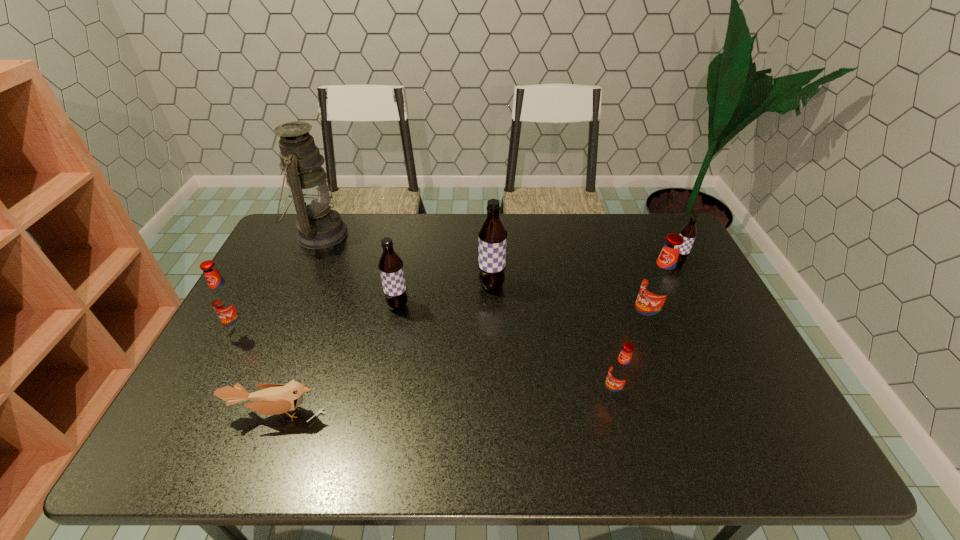
You are a GUI agent. You are given a task and a screenshot of the screen. Output one action in this format:
    pyautogui.click(x=<x>, y=<y>)
    Task: Click on the vacant space positioned on the back of the farthest root beer
    The width and height of the screenshot is (960, 540).
    Given the screenshot: What is the action you would take?
    pyautogui.click(x=661, y=232)

Locate an element on the screen. This screenshot has width=960, height=540. free space located at the beak of the bird is located at coordinates (261, 456).

Locate an element on the screen. The image size is (960, 540). object at the far edge is located at coordinates (319, 227).

The image size is (960, 540). In order to click on object located at the near edge in this screenshot , I will do (274, 399).

This screenshot has width=960, height=540. In order to click on oil lamp present at the left edge in this screenshot , I will do `click(319, 227)`.

Locate an element on the screen. This screenshot has height=540, width=960. root beer that is at the left edge is located at coordinates (225, 300).

This screenshot has width=960, height=540. I want to click on bird positioned at the left edge, so 274,399.

Identify the location of object located in the right edge section of the desktop. This screenshot has height=540, width=960. (688, 232).

Find the location of `object that is at the far left corner`. object that is at the far left corner is located at coordinates (319, 227).

Where is `object located in the near left corner section of the desktop`? Image resolution: width=960 pixels, height=540 pixels. object located in the near left corner section of the desktop is located at coordinates (274, 399).